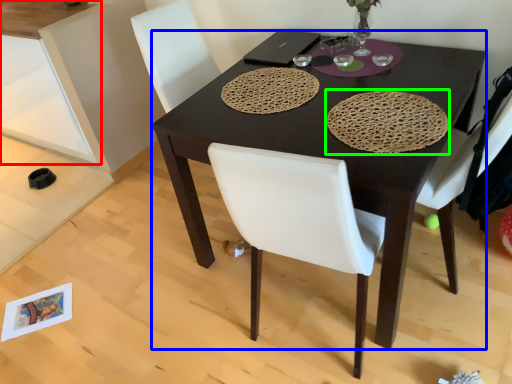
Question: Which is nearer to the cabinetry (highlighted by a red box)? desk (highlighted by a blue box) or mat (highlighted by a green box).

Choices:
 (A) desk
 (B) mat

Answer: (A)